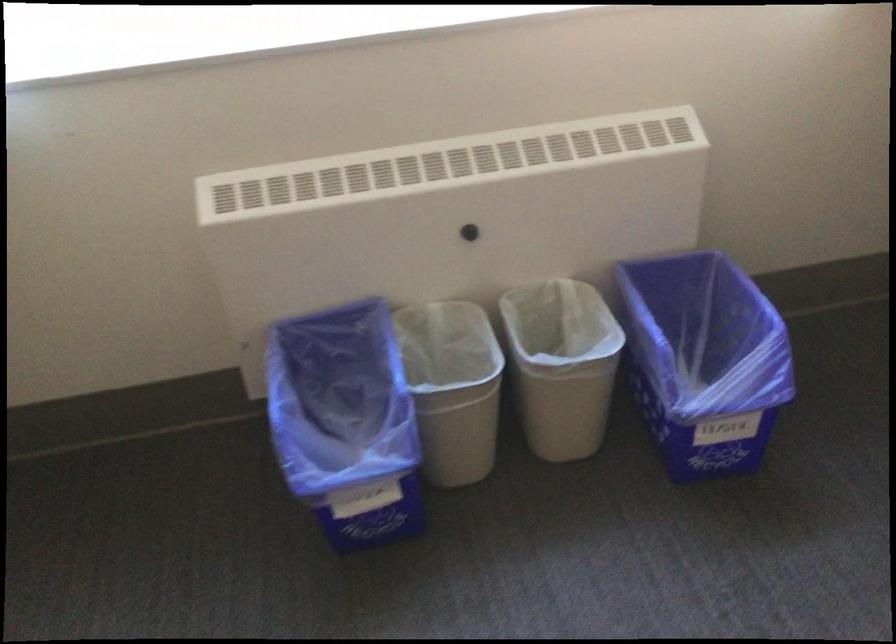
This screenshot has width=896, height=644. What do you see at coordinates (469, 232) in the screenshot?
I see `the black heater knob` at bounding box center [469, 232].